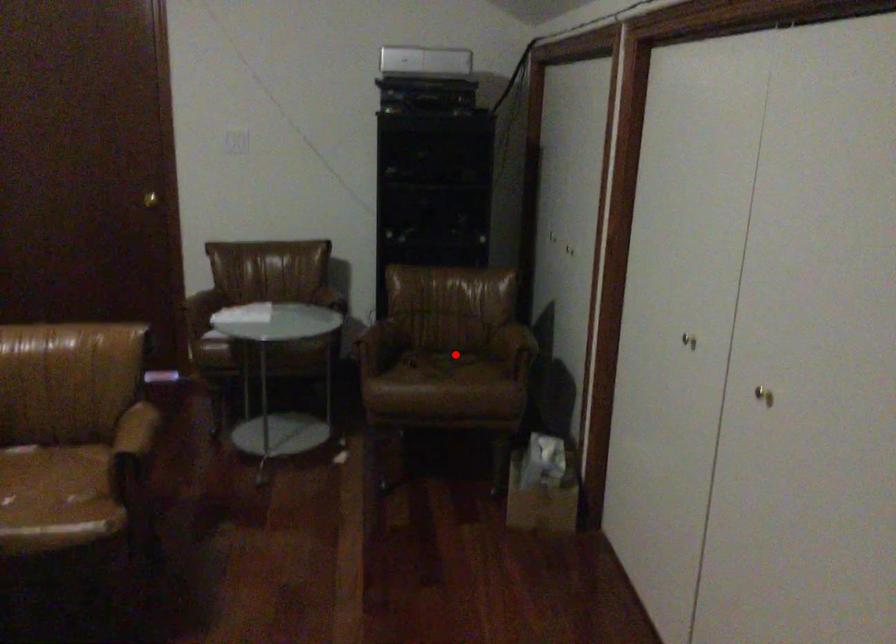
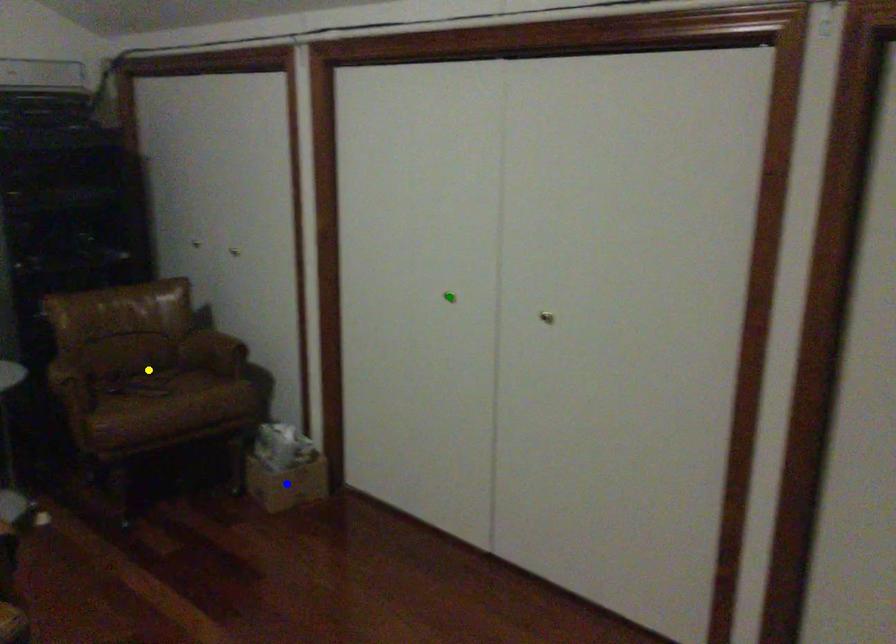
Question: I am providing you with two images of the same scene from different viewpoints. A red point is marked on the first image. You are given multiple points on the second image. Which mark in image 2 goes with the point in image 1?

Choices:
 (A) yellow point
 (B) blue point
 (C) green point

Answer: (A)